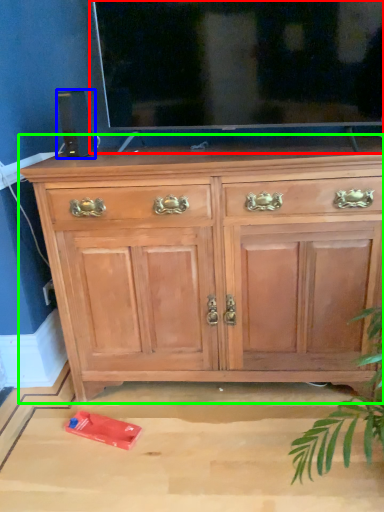
Question: Estimate the real-world distances between objects in this image. Which object is closer to glass door (highlighted by a red box), speaker (highlighted by a blue box) or chest of drawers (highlighted by a green box)?

Choices:
 (A) speaker
 (B) chest of drawers

Answer: (A)